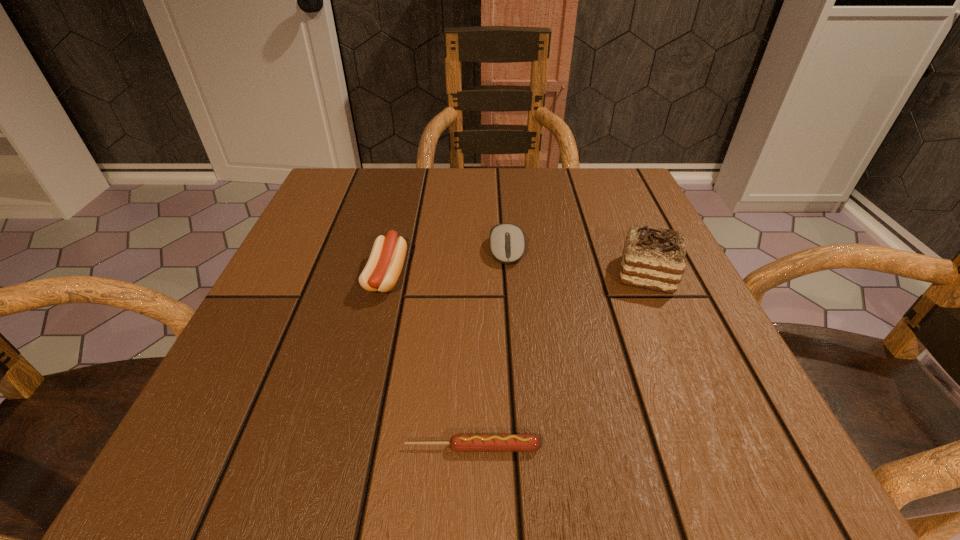
Identify the location of object that stands as the third closest to the right sausage. This screenshot has height=540, width=960. (507, 242).

This screenshot has height=540, width=960. I want to click on vacant area in the image that satisfies the following two spatial constraints: 1. on the front side of the nearest object; 2. on the right side of the taller sausage, so pos(345,447).